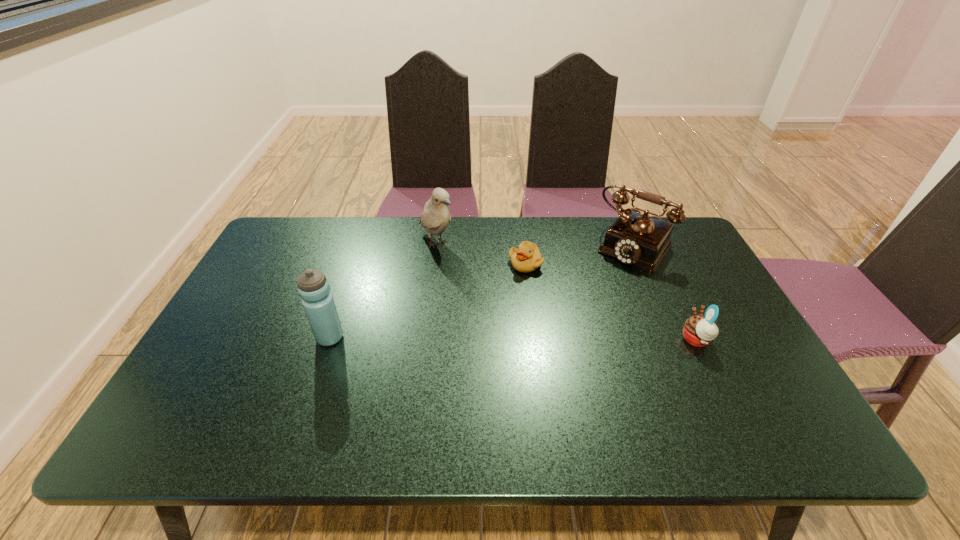
I want to click on the leftmost object, so click(313, 287).

At what (x,y) coordinates should I click in order to perform the action: click on muffin. Please return your answer as a coordinate pair (x, y). This screenshot has width=960, height=540. Looking at the image, I should click on coord(699,331).

At what (x,y) coordinates should I click in order to perform the action: click on the second object from left to right. Please return your answer as a coordinate pair (x, y). The width and height of the screenshot is (960, 540). Looking at the image, I should click on (435, 218).

Locate an element on the screen. duckling is located at coordinates (526, 258).

You are a GUI agent. You are given a task and a screenshot of the screen. Output one action in this format:
    pyautogui.click(x=<x>, y=<y>)
    Task: Click on the shortest object
    
    Given the screenshot: What is the action you would take?
    pyautogui.click(x=526, y=258)

At what (x,y) coordinates should I click in order to perform the action: click on telephone. Please return your answer as a coordinate pair (x, y). Looking at the image, I should click on (637, 239).

Identify the location of vacant position located 0.390m on the back of the leftmost object. (363, 239).

Find the location of a particular element. The image size is (960, 540). free space located on the front-facing side of the fourth tallest object is located at coordinates (607, 340).

I want to click on vacant space located 0.080m on the front-facing side of the fourth tallest object, so click(x=650, y=340).

The width and height of the screenshot is (960, 540). I want to click on vacant space located on the front-facing side of the fourth tallest object, so click(618, 340).